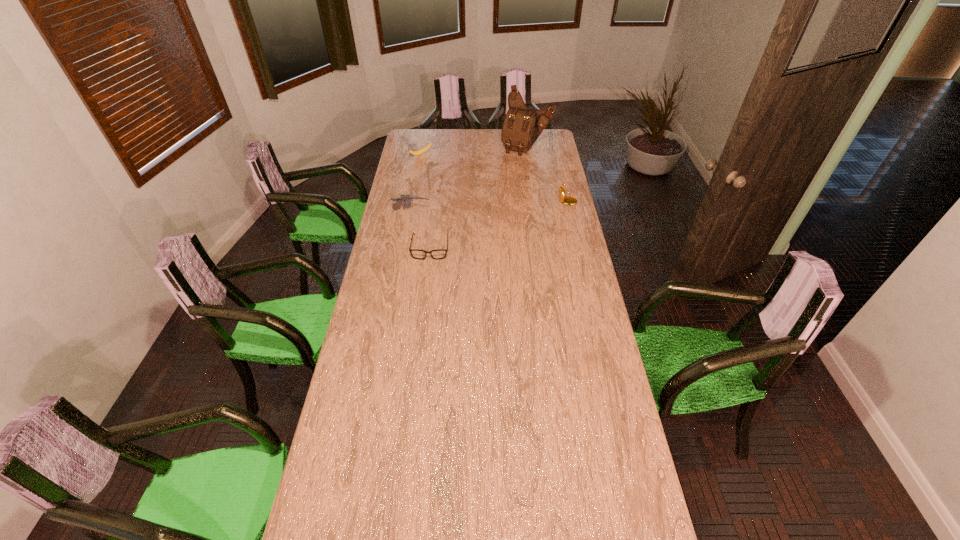
The height and width of the screenshot is (540, 960). In order to click on free spot between the second nearest object and the shoulder bag in this screenshot , I will do `click(468, 180)`.

The height and width of the screenshot is (540, 960). Find the location of `vacant space that is in between the third farthest object and the shoulder bag`. vacant space that is in between the third farthest object and the shoulder bag is located at coordinates (546, 173).

This screenshot has height=540, width=960. Identify the location of vacant area that lies between the nearest object and the tallest object. (478, 198).

You are a GUI agent. You are given a task and a screenshot of the screen. Output one action in this format:
    pyautogui.click(x=<x>, y=<y>)
    Task: Click on the vacant space that's between the pocket watch and the second nearest object
    The width and height of the screenshot is (960, 540).
    Given the screenshot: What is the action you would take?
    pyautogui.click(x=489, y=206)

You are a GUI agent. You are given a task and a screenshot of the screen. Output one action in this format:
    pyautogui.click(x=<x>, y=<y>)
    Task: Click on the free space between the spectacles and the third nearest object
    The width and height of the screenshot is (960, 540).
    Given the screenshot: What is the action you would take?
    pyautogui.click(x=498, y=224)

You are a GUI agent. You are given a task and a screenshot of the screen. Output one action in this format:
    pyautogui.click(x=<x>, y=<y>)
    Task: Click on the vacant space in between the banana and the nearest object
    
    Given the screenshot: What is the action you would take?
    pyautogui.click(x=425, y=201)

Where is `free point between the banana and the shoulder bag`? This screenshot has height=540, width=960. free point between the banana and the shoulder bag is located at coordinates (474, 151).

This screenshot has height=540, width=960. I want to click on free space between the spectacles and the banana, so click(425, 201).

Where is `object that is the second nearest to the shoulder bag`? The height and width of the screenshot is (540, 960). object that is the second nearest to the shoulder bag is located at coordinates (421, 151).

Select which object is the second closest to the spectacles. Please provide its 2D coordinates. Your answer should be formatted as a tuple, i.e. [(x, y)], where the tuple contains the x and y coordinates of a point satisfying the conditions above.

[(568, 200)]